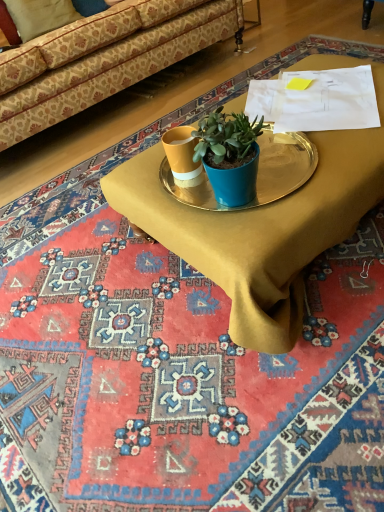
This screenshot has height=512, width=384. What are the coordinates of `vacant area that lies to the right of metallic gold tray at center` in the screenshot? It's located at (295, 174).